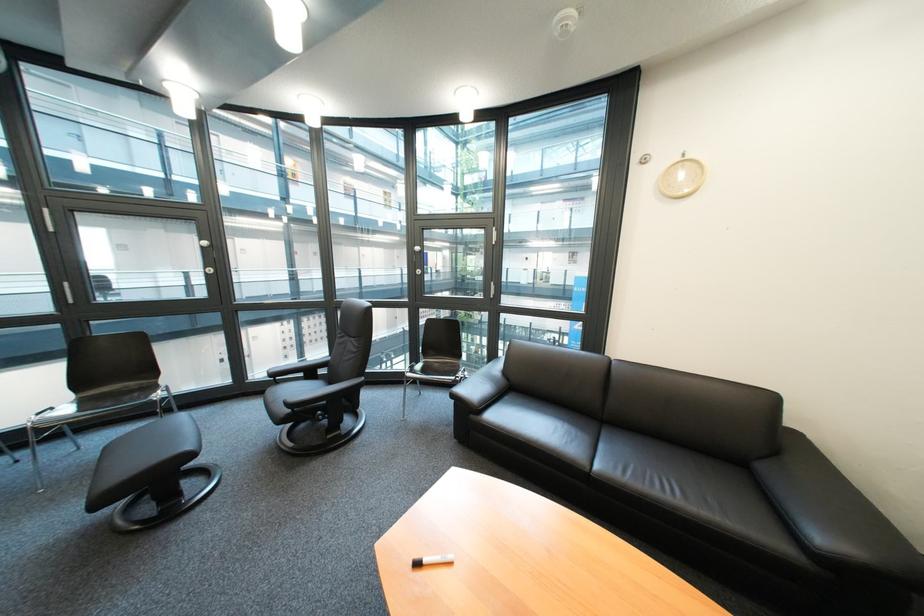
Find the location of a particular element. This screenshot has width=924, height=616. silver door handle is located at coordinates (207, 254).